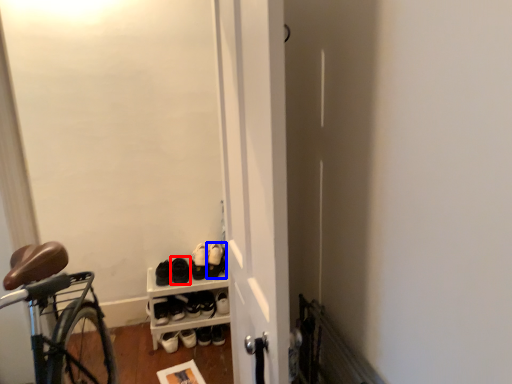
Question: Among these objects, which one is nearest to the camera, footwear (highlighted by a red box) or footwear (highlighted by a blue box)?

Choices:
 (A) footwear
 (B) footwear

Answer: (A)